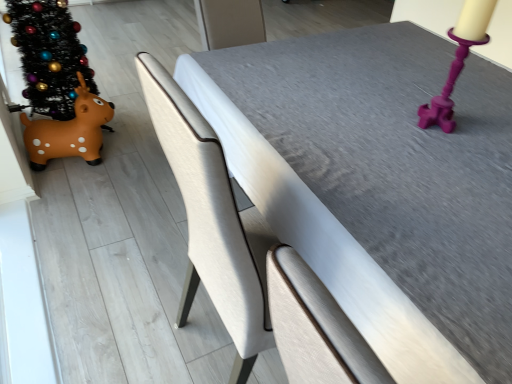
Find the location of a particular element. The image size is (512, 384). free point in front of purple plastic candle holder at upper right is located at coordinates point(437,156).